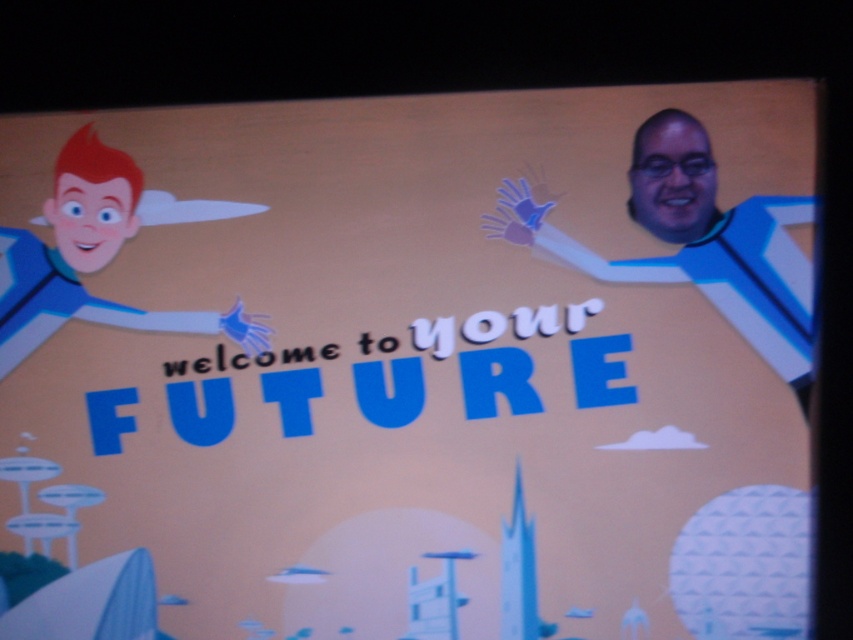
Is point (759, 225) in front of point (77, 285)?

Yes, it is in front of point (77, 285).

Does blue plastic man at right appear on the right side of smooth blue suit at left?

Yes, blue plastic man at right is to the right of smooth blue suit at left.

Who is more forward, [672,182] or [91,196]?

Point [672,182] is in front.

Find the location of a particular element. blue plastic man at right is located at coordinates (695, 241).